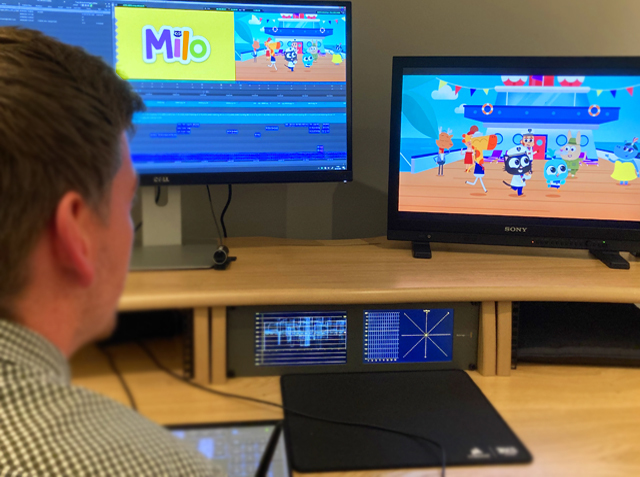
You are a GUI agent. You are given a task and a screenshot of the screen. Output one action in this format:
    pyautogui.click(x=<x>, y=<y>)
    Task: Click on the monitor
    The height and width of the screenshot is (477, 640).
    Given the screenshot: What is the action you would take?
    pyautogui.click(x=484, y=228)